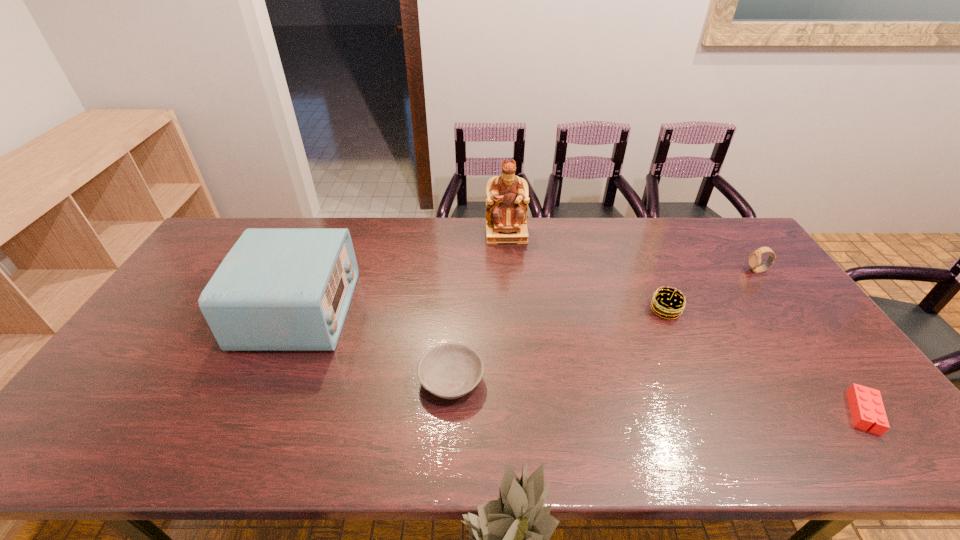
Locate an element on the screen. blank space located on the front-facing side of the figurine is located at coordinates (510, 273).

This screenshot has height=540, width=960. In order to click on blank space located on the front panel of the leftmost object in this screenshot , I will do `click(379, 310)`.

Where is `free spot located on the face of the fourth shortest object`? The height and width of the screenshot is (540, 960). free spot located on the face of the fourth shortest object is located at coordinates (675, 271).

What are the coordinates of `vacant region located on the face of the fourth shortest object` in the screenshot? It's located at (657, 271).

You are a GUI agent. You are given a task and a screenshot of the screen. Output one action in this format:
    pyautogui.click(x=<x>, y=<y>)
    Task: Click on the blank space located 0.230m on the face of the fourth shortest object
    This screenshot has height=540, width=960.
    Given the screenshot: What is the action you would take?
    pyautogui.click(x=678, y=271)

Locate an element on the screen. The width and height of the screenshot is (960, 540). vacant space located on the back of the patty is located at coordinates (646, 266).

Where is `vacant area located on the right of the fifth tallest object`? vacant area located on the right of the fifth tallest object is located at coordinates (511, 380).

The image size is (960, 540). I want to click on vacant area situated on the back of the Lego, so click(818, 350).

This screenshot has width=960, height=540. In order to click on object that is at the far edge in this screenshot , I will do `click(507, 200)`.

Locate an element on the screen. object located at the near edge is located at coordinates (866, 405).